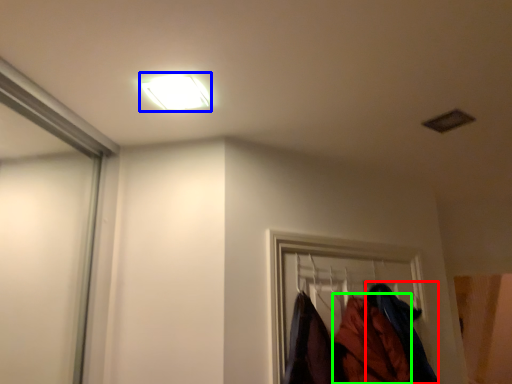
Question: Based on their relative distances, which object is nearer to clothing (highlighted by a red box)? Choose from lamp (highlighted by a blue box) and clothing (highlighted by a green box).

Choices:
 (A) lamp
 (B) clothing

Answer: (B)